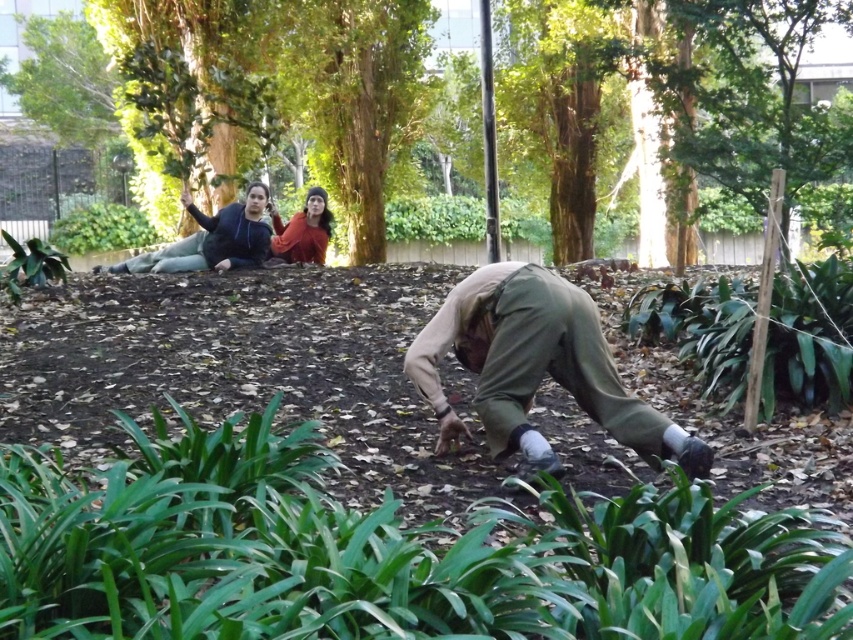
You are a drone operator trying to capture a photo of both the matte khaki pants at center and the orange sweater at upper center in the same frame. The camera has a maximum focal length that allows capturing objects up to 6 meters apart. Will you be able to include both in the frame?

The matte khaki pants at center and orange sweater at upper center are 6.51 meters apart, which exceeds the camera maximum focal length of 6 meters, so you cannot include both in the same frame.

You are standing in the park and see two points marked in the scene. Which point is closer to you, point (578,88) or point (311,188)?

Point (311,188) is closer to you because it is less further to the camera than point (578,88).

You are standing at the location of the person in the foreground. You want to walk straight towards the brown textured tree at upper center. Is the matte khaki pants at center in your way? Please explain why or why not.

The matte khaki pants at center is 6.57 meters away from the brown textured tree at upper center. Since you are standing at the person in the foreground, the matte khaki pants at center is between you and the tree, so it would be in your way if you walk straight towards the tree.